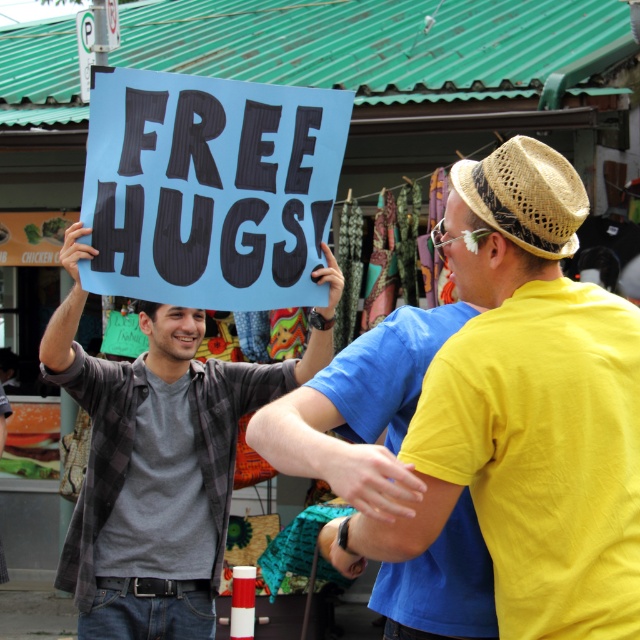
Question: Estimate the real-world distances between objects in this image. Which object is farther from the yellow matte shirt at right?

Choices:
 (A) matte gray shirt at center
 (B) blue paper sign at upper center

Answer: (A)

Question: Is matte gray shirt at center below straw woven hat at upper right?

Choices:
 (A) yes
 (B) no

Answer: (A)

Question: Does yellow matte shirt at right appear over matte gray shirt at center?

Choices:
 (A) yes
 (B) no

Answer: (A)

Question: Estimate the real-world distances between objects in this image. Which object is farther from the yellow matte shirt at right?

Choices:
 (A) blue paper sign at upper center
 (B) straw woven hat at upper right
 (C) matte gray shirt at center

Answer: (C)

Question: Is blue paper sign at upper center smaller than matte gray shirt at center?

Choices:
 (A) no
 (B) yes

Answer: (B)

Question: Which object is positioned farthest from the straw woven hat at upper right?

Choices:
 (A) yellow matte shirt at right
 (B) blue paper sign at upper center
 (C) matte gray shirt at center

Answer: (C)